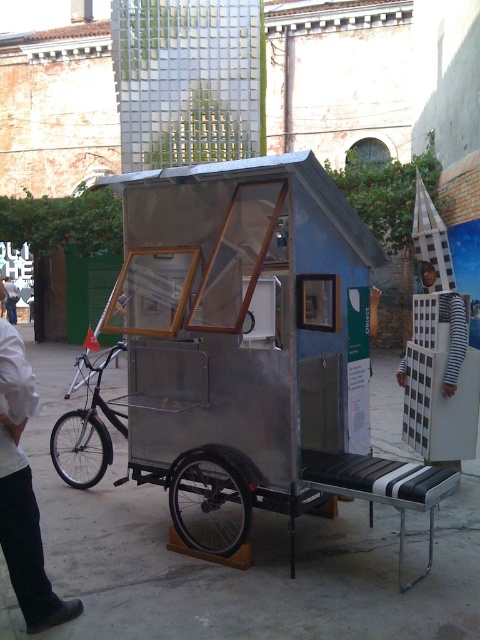
Does silver metallic wheel at lower center have a greater width compared to black matte bicycle at left?

Incorrect, silver metallic wheel at lower center's width does not surpass black matte bicycle at left's.

Is point (188, 524) positioned behind point (94, 476)?

No, (188, 524) is in front of (94, 476).

Where is `silver metallic wheel at lower center`? This screenshot has width=480, height=640. silver metallic wheel at lower center is located at coordinates (210, 502).

Who is positioned more to the left, silver metallic wheel at left or white striped shirt at lower right?

Positioned to the left is white striped shirt at lower right.

Which is in front, point (64, 474) or point (9, 282)?

Point (64, 474) is more forward.

The image size is (480, 640). In order to click on silver metallic wheel at left in this screenshot , I will do `click(80, 448)`.

Which is in front, point (32, 564) or point (78, 429)?

Point (32, 564) is more forward.

Which is more to the right, white cotton shirt at left or silver metallic wheel at left?

white cotton shirt at left is more to the right.

This screenshot has width=480, height=640. Find the location of `white cotton shirt at left`. white cotton shirt at left is located at coordinates (23, 493).